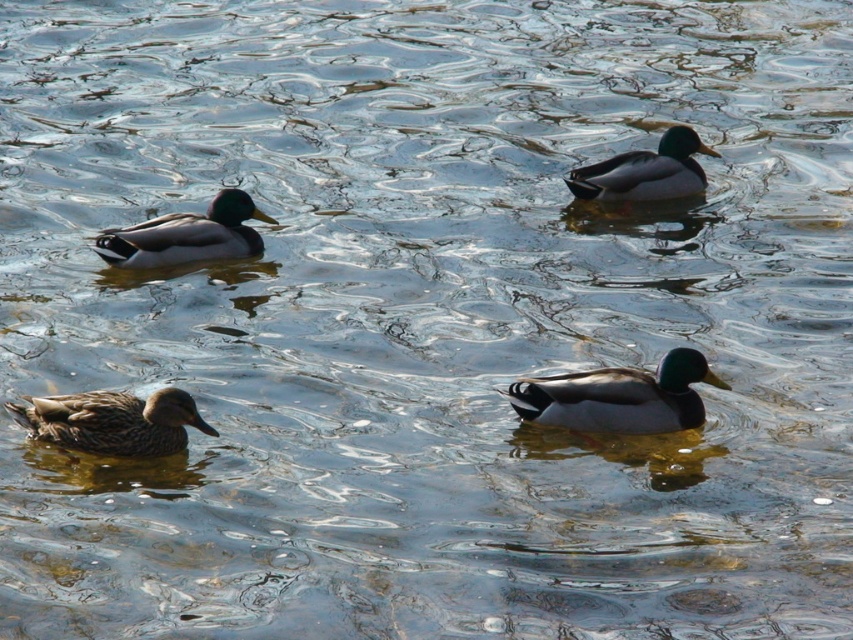
You are a photographer aiming to capture a clear shot of the green glossy duck at left and the shiny brown duck at upper right. Since you want both ducks to be in focus, which duck should you focus on first to ensure the other is also sharp?

The green glossy duck at left is in front of the shiny brown duck at upper right. Therefore, you should focus on the green glossy duck at left first to ensure both are in focus.

You are observing the ducks in the water. Which duck, the green glossy duck at left or the shiny brown duck at upper right, is bigger in size?

The green glossy duck at left is larger in size than the shiny brown duck at upper right.

You are observing the ducks in the water. Which duck is positioned lower in the image, the brown matte duck at lower left or the shiny brown duck at upper right?

The brown matte duck at lower left is positioned below the shiny brown duck at upper right, so it is lower in the image.